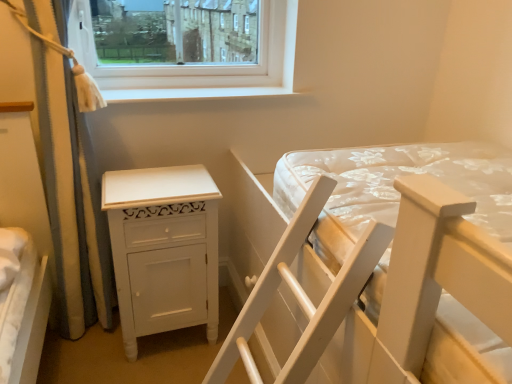
Question: From their relative heights in the image, would you say white textured curtain at left is taller or shorter than white wooden bed at center?

Choices:
 (A) tall
 (B) short

Answer: (A)

Question: Based on their positions, is white textured curtain at left located to the left or right of white wooden bed at center?

Choices:
 (A) left
 (B) right

Answer: (A)

Question: Which object is the closest to the white wooden bed at center?

Choices:
 (A) white smooth window sill at upper center
 (B) white painted wood nightstand at lower left
 (C) white textured curtain at left

Answer: (B)

Question: Which of these objects is positioned closest to the white painted wood nightstand at lower left?

Choices:
 (A) white textured curtain at left
 (B) white smooth window sill at upper center
 (C) white wooden bed at center

Answer: (A)